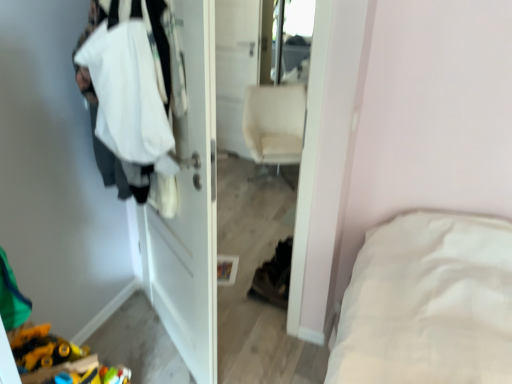
Question: Is glossy plastic mirror at upper center inside beige fabric chair at center?

Choices:
 (A) no
 (B) yes

Answer: (A)

Question: Does beige fabric chair at center appear on the left side of glossy plastic mirror at upper center?

Choices:
 (A) yes
 (B) no

Answer: (A)

Question: From a real-world perspective, is beige fabric chair at center on glossy plastic mirror at upper center?

Choices:
 (A) yes
 (B) no

Answer: (B)

Question: Can you confirm if beige fabric chair at center is shorter than glossy plastic mirror at upper center?

Choices:
 (A) no
 (B) yes

Answer: (B)

Question: From the image's perspective, is beige fabric chair at center located above glossy plastic mirror at upper center?

Choices:
 (A) yes
 (B) no

Answer: (B)

Question: Is white matte door at center wider or thinner than glossy plastic mirror at upper center?

Choices:
 (A) thin
 (B) wide

Answer: (A)

Question: From the image's perspective, is white matte door at center positioned above or below glossy plastic mirror at upper center?

Choices:
 (A) below
 (B) above

Answer: (A)

Question: From their relative heights in the image, would you say white matte door at center is taller or shorter than glossy plastic mirror at upper center?

Choices:
 (A) tall
 (B) short

Answer: (A)

Question: From a real-world perspective, is white matte door at center physically located above or below glossy plastic mirror at upper center?

Choices:
 (A) below
 (B) above

Answer: (A)

Question: In terms of size, does white matte door at center appear bigger or smaller than beige fabric chair at center?

Choices:
 (A) big
 (B) small

Answer: (B)

Question: Considering the positions of white matte door at center and beige fabric chair at center in the image, is white matte door at center taller or shorter than beige fabric chair at center?

Choices:
 (A) tall
 (B) short

Answer: (A)

Question: Considering the positions of white matte door at center and beige fabric chair at center in the image, is white matte door at center wider or thinner than beige fabric chair at center?

Choices:
 (A) thin
 (B) wide

Answer: (A)

Question: Relative to beige fabric chair at center, is white matte door at center in front or behind?

Choices:
 (A) behind
 (B) front

Answer: (B)

Question: Does point (214, 124) appear closer or farther from the camera than point (117, 185)?

Choices:
 (A) closer
 (B) farther

Answer: (A)

Question: Looking at the image, does white matte door at center seem bigger or smaller compared to white fabric at left?

Choices:
 (A) small
 (B) big

Answer: (A)